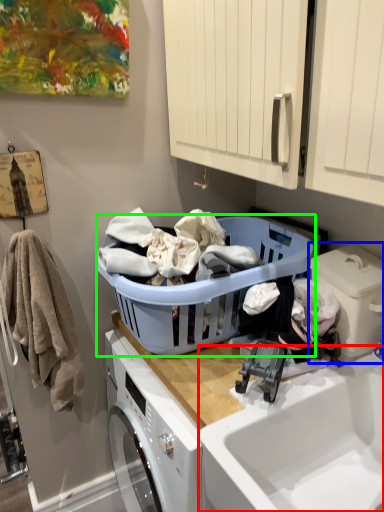
Question: Based on their relative distances, which object is nearer to sink (highlighted by a red box)? Choose from washing machine (highlighted by a blue box) and laundry basket (highlighted by a green box).

Choices:
 (A) washing machine
 (B) laundry basket

Answer: (A)